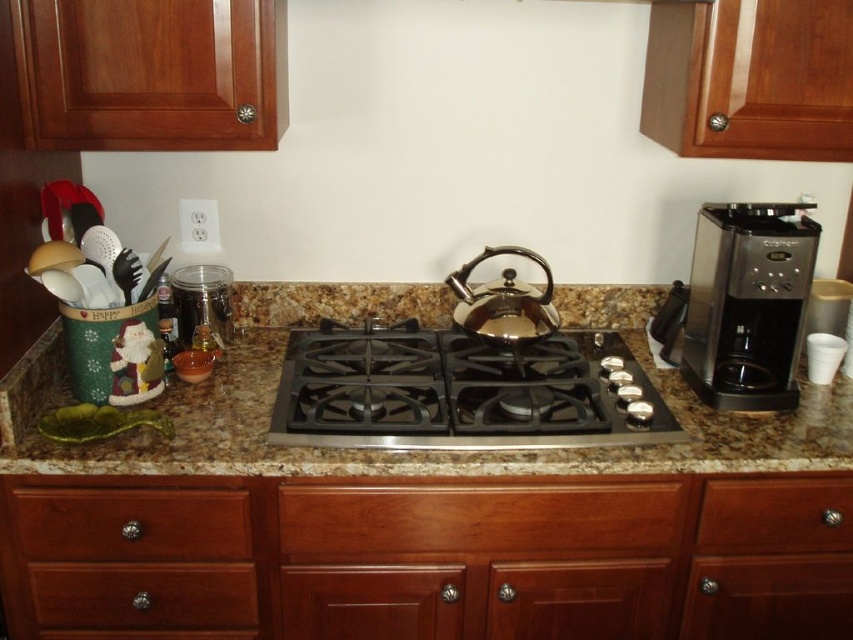
You are preparing tea and need to place the shiny metallic teapot at center on the black stainless steel gas stove at center. Is there enough space for the teapot to fit on the stove?

The black stainless steel gas stove at center is below the shiny metallic teapot at center, so yes, the teapot can be placed on the stove as it is positioned above it.

You are organizing the kitchen and need to place a new spice jar between the wooden drawer at lower left and the shiny metallic teapot at center. Based on their positions, where should you place the spice jar?

The wooden drawer at lower left is located below the shiny metallic teapot at center, so you should place the spice jar between them either above the wooden drawer at lower left or below the shiny metallic teapot at center to ensure it is in between both objects.